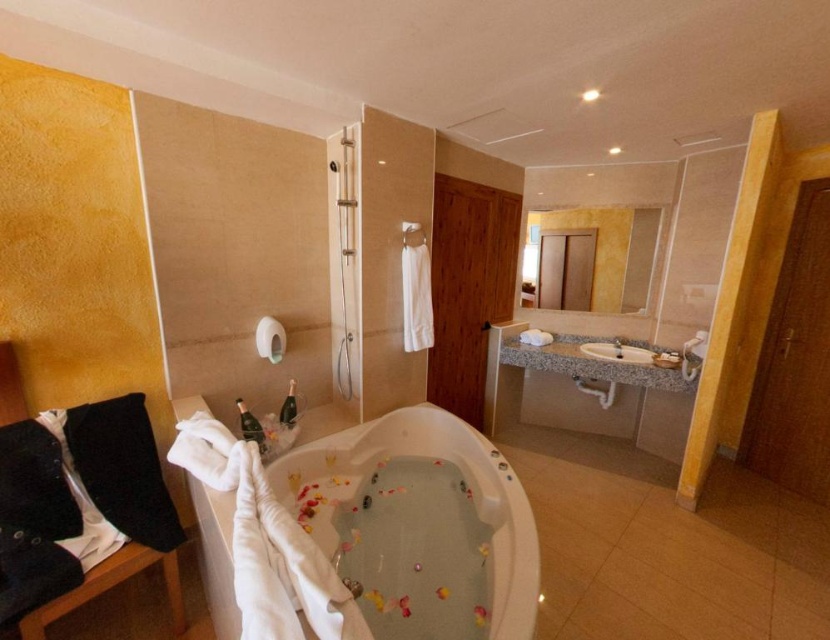
Is the position of white glossy bathtub at center less distant than that of white marble sink at center?

Yes, it is in front of white marble sink at center.

Is point (252, 625) closer to camera compared to point (603, 344)?

Yes, point (252, 625) is in front of point (603, 344).

The image size is (830, 640). I want to click on white glossy bathtub at center, so click(364, 532).